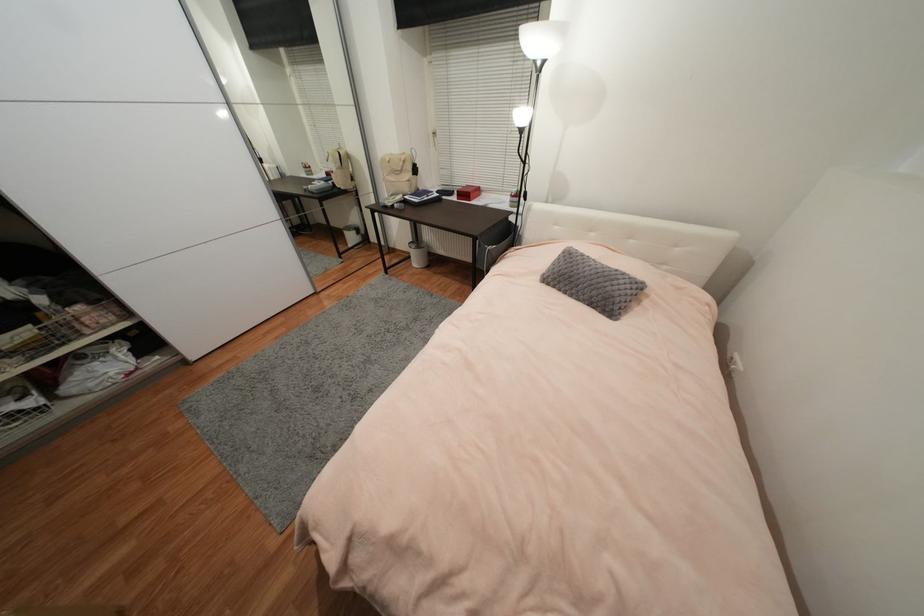
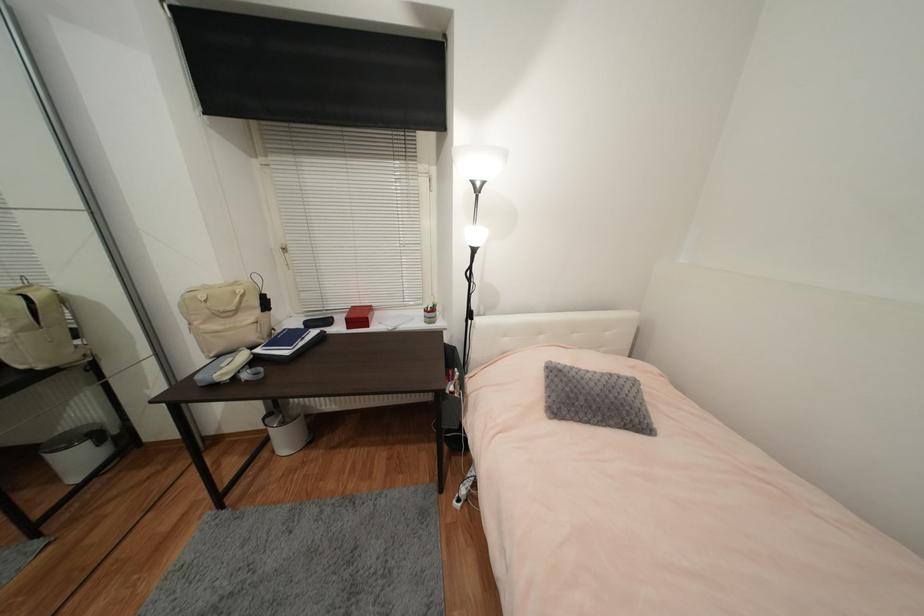
In the second image, find the point that corresponds to (591,274) in the first image.

(602, 391)